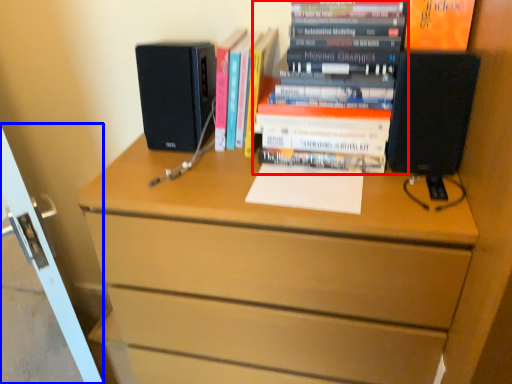
Question: Among these objects, which one is nearest to the camera, book (highlighted by a red box) or screen door (highlighted by a blue box)?

Choices:
 (A) book
 (B) screen door

Answer: (B)